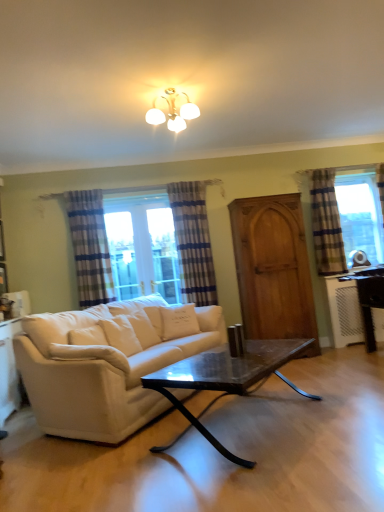
Measure the distance between white plush pillow at center, marked as the first pillow in a front-to-back arrangement, and camera.

The distance of white plush pillow at center, marked as the first pillow in a front-to-back arrangement, from camera is 2.85 meters.

What is the approximate width of white fabric couch at center?

It is 37.83 inches.

Identify the location of white plush pillow at center, the second pillow when ordered from back to front. (90, 354).

Can you confirm if wooden screen door at center is shorter than marble black coffee table at center?

In fact, wooden screen door at center may be taller than marble black coffee table at center.

Which object is thinner, wooden screen door at center or marble black coffee table at center?

Thinner between the two is wooden screen door at center.

Which is more to the right, wooden screen door at center or marble black coffee table at center?

wooden screen door at center is more to the right.

Is blue striped curtain at right, acting as the 1th curtain starting from the right, positioned beyond the bounds of white fabric pillow at center, positioned as the 2th pillow in left-to-right order?

Yes, blue striped curtain at right, acting as the 1th curtain starting from the right, is outside of white fabric pillow at center, positioned as the 2th pillow in left-to-right order.

Locate an element on the screen. This screenshot has height=512, width=384. pillow that is the 1st one when counting downward from the blue striped curtain at right, acting as the 1th curtain starting from the right (from the image's perspective) is located at coordinates (178, 321).

Is blue striped curtain at right, which appears as the third curtain when viewed from the left, not near white fabric pillow at center, the first pillow viewed from the right?

blue striped curtain at right, which appears as the third curtain when viewed from the left, is positioned a significant distance from white fabric pillow at center, the first pillow viewed from the right.

Is white glossy light fixture at upper center positioned beyond the bounds of white fabric pillow at center, which is the 1th pillow from back to front?

Absolutely, white glossy light fixture at upper center is external to white fabric pillow at center, which is the 1th pillow from back to front.

You are a GUI agent. You are given a task and a screenshot of the screen. Output one action in this format:
    pyautogui.click(x=<x>, y=<y>)
    Task: Click on the 1st pillow below the white glossy light fixture at upper center (from a real-world perspective)
    
    Given the screenshot: What is the action you would take?
    pyautogui.click(x=178, y=321)

From a real-world perspective, is white glossy light fixture at upper center positioned over white fabric pillow at center, the first pillow viewed from the right, based on gravity?

Indeed, from a real-world perspective, white glossy light fixture at upper center stands above white fabric pillow at center, the first pillow viewed from the right.

How much distance is there between white glossy light fixture at upper center and white fabric pillow at center, positioned as the 2th pillow in left-to-right order?

The distance of white glossy light fixture at upper center from white fabric pillow at center, positioned as the 2th pillow in left-to-right order, is 6.28 feet.

From the image's perspective, is white fabric pillow at center, which is the 1th pillow from back to front, positioned above or below wooden screen door at center?

Clearly, from the image's perspective, white fabric pillow at center, which is the 1th pillow from back to front, is below wooden screen door at center.

Identify the location of screen door above the white fabric pillow at center, the 2th pillow viewed from the front (from a real-world perspective). The width and height of the screenshot is (384, 512). (273, 268).

Considering the sizes of white fabric pillow at center, positioned as the 2th pillow in left-to-right order, and wooden screen door at center in the image, is white fabric pillow at center, positioned as the 2th pillow in left-to-right order, taller or shorter than wooden screen door at center?

In the image, white fabric pillow at center, positioned as the 2th pillow in left-to-right order, appears to be shorter than wooden screen door at center.

Is white plush pillow at center, the second pillow when ordered from back to front, located outside white fabric pillow at center, the 2th pillow viewed from the front?

That's correct, white plush pillow at center, the second pillow when ordered from back to front, is outside of white fabric pillow at center, the 2th pillow viewed from the front.

From a real-world perspective, which object stands above the other?

white fabric pillow at center, which is the 1th pillow from back to front.

From the picture: Considering the positions of objects white plush pillow at center, the second pillow when ordered from back to front, and white fabric pillow at center, the 2th pillow viewed from the front, in the image provided, who is behind, white plush pillow at center, the second pillow when ordered from back to front, or white fabric pillow at center, the 2th pillow viewed from the front,?

white fabric pillow at center, the 2th pillow viewed from the front, is more distant.

Considering the positions of objects white plush pillow at center, the second pillow when ordered from back to front, and blue striped curtain at right, acting as the 1th curtain starting from the right, in the image provided, who is more to the left, white plush pillow at center, the second pillow when ordered from back to front, or blue striped curtain at right, acting as the 1th curtain starting from the right,?

white plush pillow at center, the second pillow when ordered from back to front.

Which object is closer to the camera taking this photo, white plush pillow at center, the second pillow when ordered from back to front, or blue striped curtain at right, which appears as the third curtain when viewed from the left?

white plush pillow at center, the second pillow when ordered from back to front.

Between white plush pillow at center, the second pillow in the right-to-left sequence, and blue striped curtain at right, which appears as the third curtain when viewed from the left, which one has smaller width?

blue striped curtain at right, which appears as the third curtain when viewed from the left.

Consider the image. Is white plush pillow at center, marked as the first pillow in a front-to-back arrangement, far from blue striped curtain at right, acting as the 1th curtain starting from the right?

Yes, white plush pillow at center, marked as the first pillow in a front-to-back arrangement, and blue striped curtain at right, acting as the 1th curtain starting from the right, are quite far apart.

In the image, is white glossy light fixture at upper center on the left side or the right side of striped fabric curtain at left, the 1th curtain positioned from the left?

Based on their positions, white glossy light fixture at upper center is located to the right of striped fabric curtain at left, the 1th curtain positioned from the left.

Is white glossy light fixture at upper center wider or thinner than striped fabric curtain at left, the 1th curtain positioned from the left?

white glossy light fixture at upper center is wider than striped fabric curtain at left, the 1th curtain positioned from the left.

Based on the photo, considering the relative sizes of white glossy light fixture at upper center and striped fabric curtain at left, the third curtain from the right, in the image provided, is white glossy light fixture at upper center taller than striped fabric curtain at left, the third curtain from the right,?

In fact, white glossy light fixture at upper center may be shorter than striped fabric curtain at left, the third curtain from the right.

Would you consider white glossy light fixture at upper center to be distant from striped fabric curtain at left, the 1th curtain positioned from the left?

Yes, white glossy light fixture at upper center is far from striped fabric curtain at left, the 1th curtain positioned from the left.

You are a GUI agent. You are given a task and a screenshot of the screen. Output one action in this format:
    pyautogui.click(x=<x>, y=<y>)
    Task: Click on the coffee table that is under the wooden screen door at center (from a real-world perspective)
    The height and width of the screenshot is (512, 384).
    Given the screenshot: What is the action you would take?
    pyautogui.click(x=228, y=376)

This screenshot has height=512, width=384. Find the location of `the 3rd curtain behind the white fabric pillow at center, positioned as the 2th pillow in left-to-right order, counting from the anchor's position`. the 3rd curtain behind the white fabric pillow at center, positioned as the 2th pillow in left-to-right order, counting from the anchor's position is located at coordinates (326, 223).

When comparing their distances from white plush pillow at center, the second pillow in the right-to-left sequence, does wooden screen door at center or striped fabric curtain at left, the third curtain from the right, seem closer?

striped fabric curtain at left, the third curtain from the right.

Which object lies further to the anchor point white plush pillow at center, the second pillow in the right-to-left sequence, marble black coffee table at center or wooden screen door at center?

Based on the image, wooden screen door at center appears to be further to white plush pillow at center, the second pillow in the right-to-left sequence.

Estimate the real-world distances between objects in this image. Which object is closer to white plush pillow at center, the second pillow when ordered from back to front, white fabric couch at center or striped fabric curtain at left, the 1th curtain positioned from the left?

white fabric couch at center.

From the image, which object appears to be nearer to blue striped curtain at center, the second curtain from the left, white fabric couch at center or wooden screen door at center?

Among the two, wooden screen door at center is located nearer to blue striped curtain at center, the second curtain from the left.

Estimate the real-world distances between objects in this image. Which object is closer to wooden screen door at center, white fabric couch at center or blue striped curtain at right, which appears as the third curtain when viewed from the left?

blue striped curtain at right, which appears as the third curtain when viewed from the left, is positioned closer to the anchor wooden screen door at center.

Considering their positions, is blue striped curtain at center, which ranks as the 2th curtain in right-to-left order, positioned further to white glossy cabinet at lower left than striped fabric curtain at left, the third curtain from the right?

blue striped curtain at center, which ranks as the 2th curtain in right-to-left order, is further to white glossy cabinet at lower left.

Looking at the image, which one is located closer to striped fabric curtain at left, the third curtain from the right, white glossy cabinet at lower left or white fabric pillow at center, the 2th pillow viewed from the front?

white fabric pillow at center, the 2th pillow viewed from the front, is closer to striped fabric curtain at left, the third curtain from the right.

Based on the photo, from the image, which object appears to be farther from white plush pillow at center, the second pillow in the right-to-left sequence, white fabric pillow at center, the 2th pillow viewed from the front, or blue striped curtain at right, acting as the 1th curtain starting from the right?

Among the two, blue striped curtain at right, acting as the 1th curtain starting from the right, is located further to white plush pillow at center, the second pillow in the right-to-left sequence.

Identify the location of curtain between marble black coffee table at center and blue striped curtain at center, the second curtain from the left, in the front-back direction. (90, 247).

Image resolution: width=384 pixels, height=512 pixels. In order to click on cabinetry between marble black coffee table at center and striped fabric curtain at left, the third curtain from the right, along the z-axis in this screenshot , I will do `click(8, 370)`.

Where is `cabinetry positioned between white fabric couch at center and striped fabric curtain at left, the third curtain from the right, from near to far`? The height and width of the screenshot is (512, 384). cabinetry positioned between white fabric couch at center and striped fabric curtain at left, the third curtain from the right, from near to far is located at coordinates (8, 370).

I want to click on lamp between striped fabric curtain at left, the third curtain from the right, and wooden screen door at center, so click(x=173, y=112).